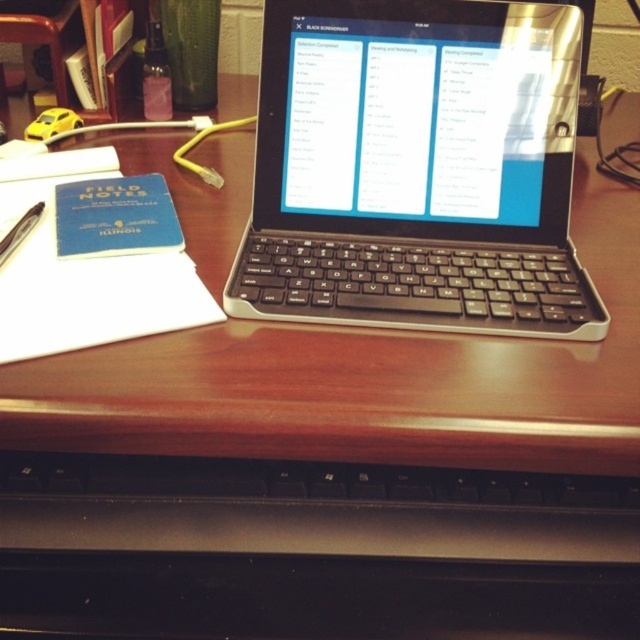
You are organizing your desk and need to place a new item between the white paper at left and the metallic pen at left. Which item should go on top to ensure it doesn

The white paper at left is taller than the metallic pen at left, so placing the new item on top of the white paper at left would ensure it is higher than the pen.

You are a delivery robot with a package that is 20 inches long. You need to place it on the desk without blocking the black plastic keyboard at center. Can you fit the package horizontally on the desk next to the keyboard?

The distance between the black plastic keyboard at center and the camera is 20.46 inches. Since the package is 20 inches long, it can be placed horizontally next to the keyboard as there is enough space.

You are organizing your desk and want to place a new item between the black plastic keyboard at center and the wooden table at center. Considering their sizes, which object should the new item be placed closer to?

The black plastic keyboard at center is shorter than the wooden table at center, so the new item should be placed closer to the wooden table at center to maintain proper alignment based on their heights.